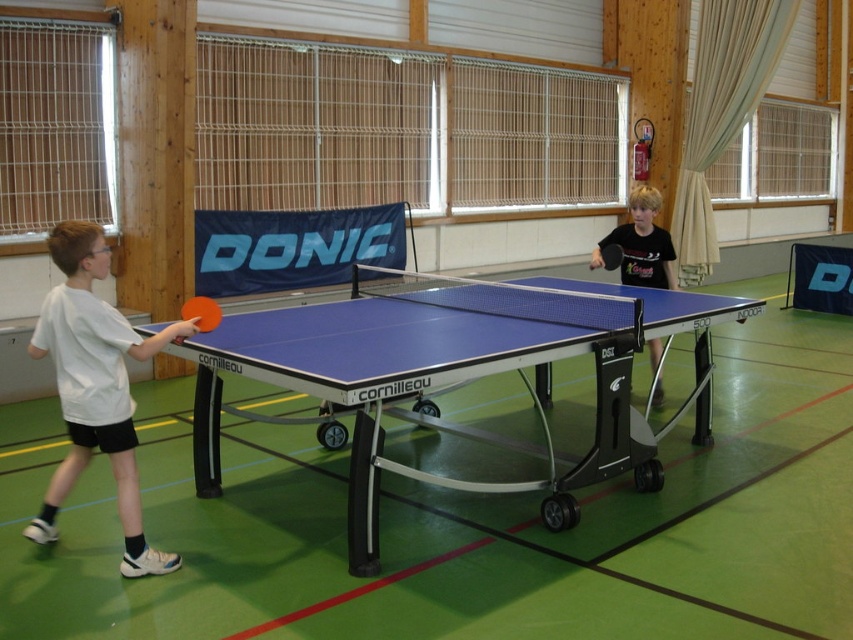
Question: Which object is farther from the camera taking this photo?

Choices:
 (A) blue glossy table tennis table at center
 (B) black matte ping pong paddle at right
 (C) white matte shirt at left

Answer: (B)

Question: Is white matte shirt at left above blue glossy table tennis table at center?

Choices:
 (A) yes
 (B) no

Answer: (B)

Question: Does white matte shirt at left appear over rubber paddle at center?

Choices:
 (A) no
 (B) yes

Answer: (A)

Question: Which point is closer to the camera?

Choices:
 (A) rubber paddle at center
 (B) blue glossy ping pong table at center
 (C) blue glossy table tennis table at center
 (D) black matte ping pong paddle at right

Answer: (B)

Question: Is white matte shirt at left to the right of rubber paddle at center from the viewer's perspective?

Choices:
 (A) no
 (B) yes

Answer: (A)

Question: Among these points, which one is farthest from the camera?

Choices:
 (A) (204, 300)
 (B) (456, 481)

Answer: (B)